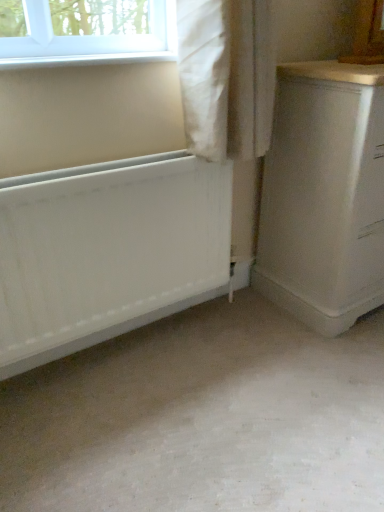
In order to face white glossy dishwasher at lower right, should I rotate leftwards or rightwards?

Rotate right and turn 24.405 degrees.

The width and height of the screenshot is (384, 512). In order to click on white glossy dishwasher at lower right in this screenshot , I will do `click(324, 195)`.

Image resolution: width=384 pixels, height=512 pixels. Describe the element at coordinates (324, 195) in the screenshot. I see `white glossy dishwasher at lower right` at that location.

Find the location of `white glossy dishwasher at lower right`. white glossy dishwasher at lower right is located at coordinates (324, 195).